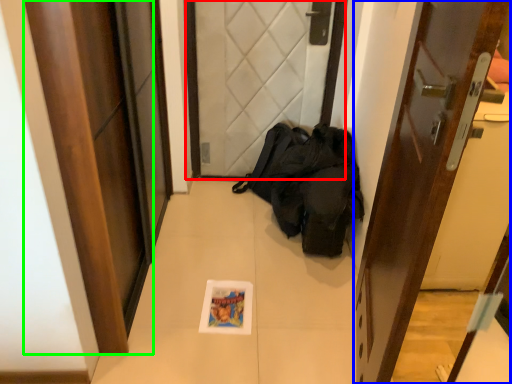
Question: Which object is the closest to the door (highlighted by a red box)? Choose among these: door (highlighted by a blue box) or door (highlighted by a green box).

Choices:
 (A) door
 (B) door

Answer: (B)